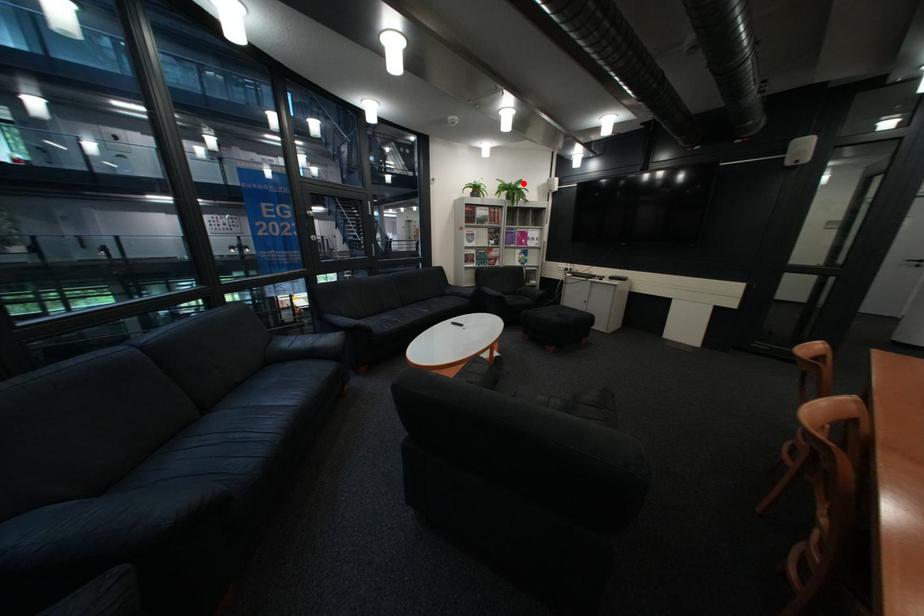
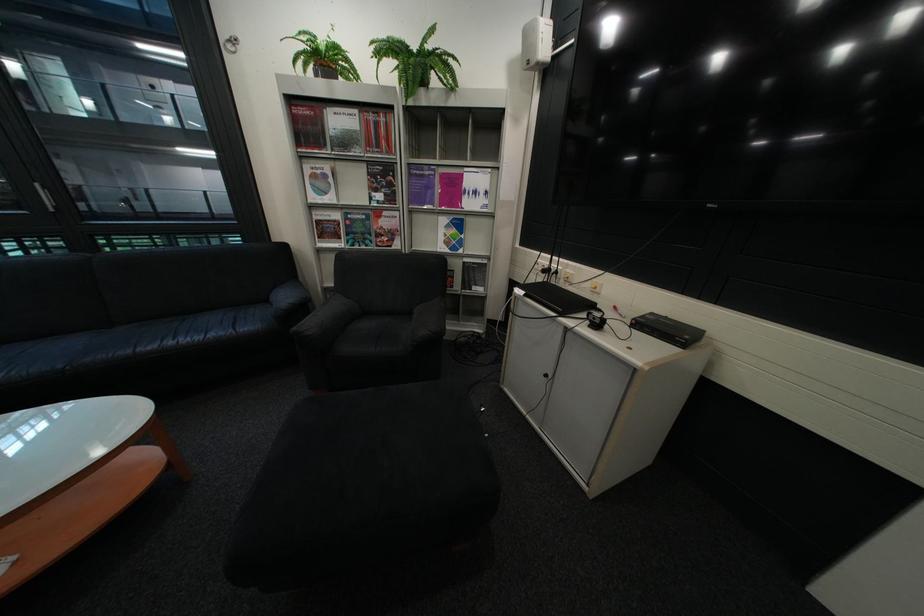
Question: I am providing you with two images of the same scene from different viewpoints. Image1 has a red point marked. In image2, the corresponding 3D location appears at what relative position? Reply with the corresponding letter.

Choices:
 (A) Closer
 (B) Farther

Answer: (B)